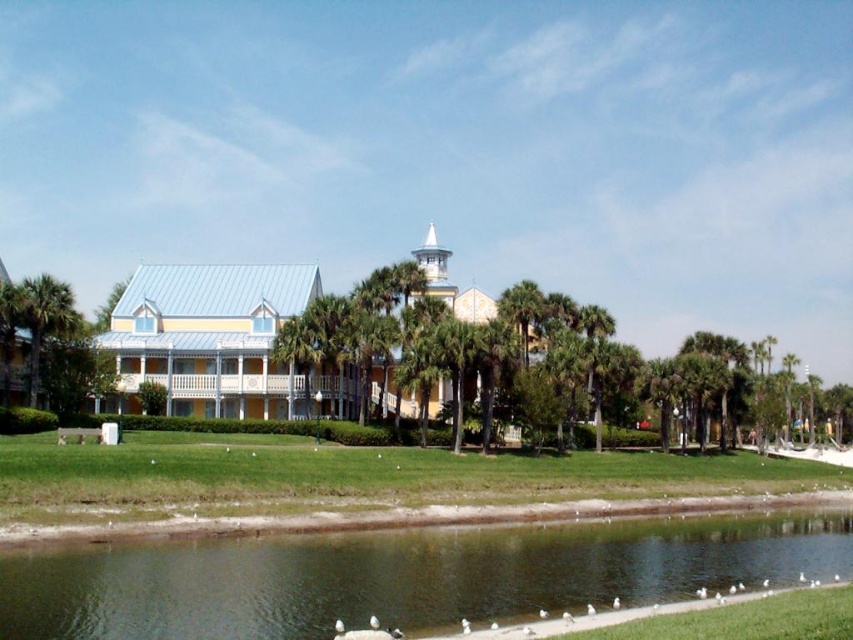
Between point (532, 536) and point (16, 291), which one is positioned behind?

The point (16, 291) is behind.

Who is shorter, green grassy bank at lower center or green leafy palm tree at left?

Standing shorter between the two is green grassy bank at lower center.

Does point (57, 557) come in front of point (67, 291)?

Yes, it is.

Locate an element on the screen. green grassy bank at lower center is located at coordinates (403, 576).